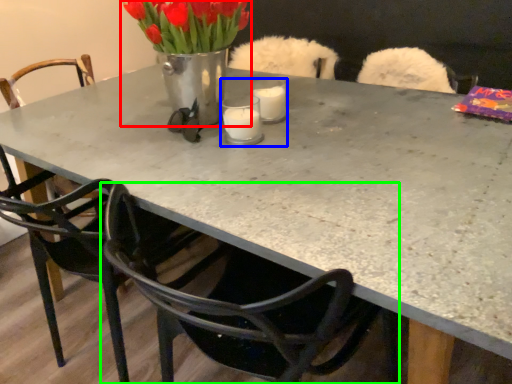
Question: Considering the real-world distances, which object is closest to floral arrangement (highlighted by a red box)? candle holder (highlighted by a blue box) or chair (highlighted by a green box).

Choices:
 (A) candle holder
 (B) chair

Answer: (A)